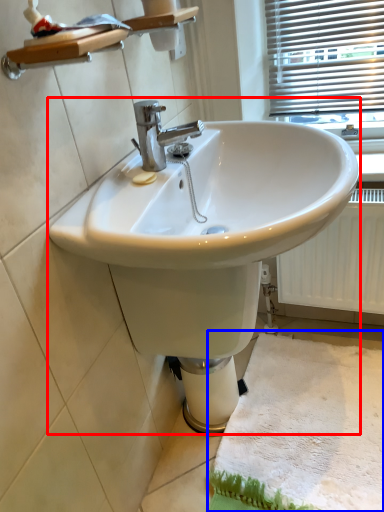
Question: Which point is closer to the camera, sink (highlighted by a red box) or bath mat (highlighted by a blue box)?

Choices:
 (A) sink
 (B) bath mat

Answer: (A)